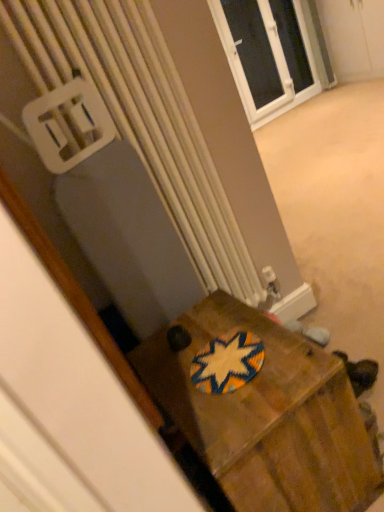
Where is `unoccupied space behind woven fabric coaster at center`? unoccupied space behind woven fabric coaster at center is located at coordinates (205, 326).